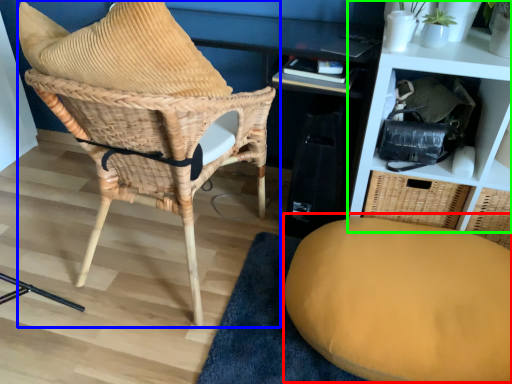
Question: Based on their relative distances, which object is nearer to swivel chair (highlighted by a red box)? Choose from chair (highlighted by a blue box) and shelf (highlighted by a green box).

Choices:
 (A) chair
 (B) shelf

Answer: (B)